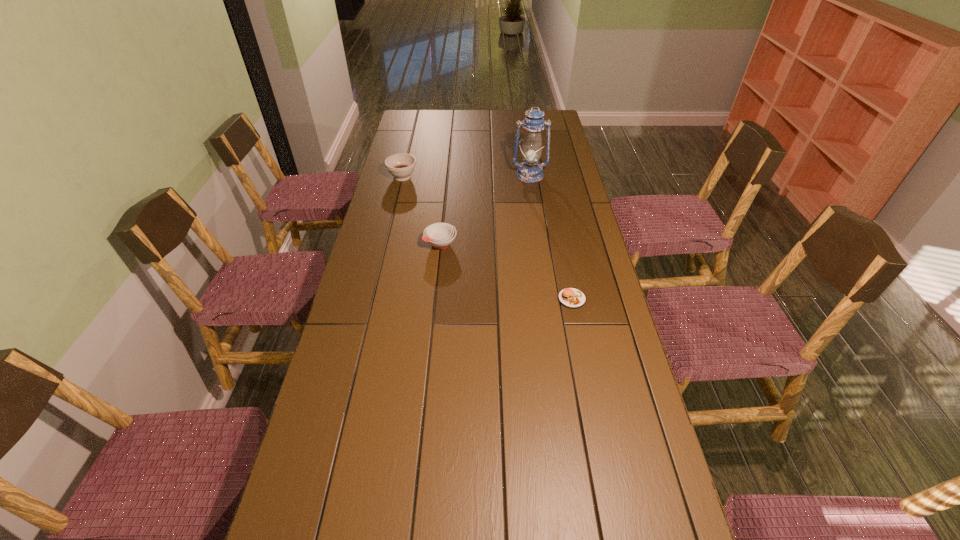
Image resolution: width=960 pixels, height=540 pixels. What are the coordinates of `free space located 0.070m on the back of the patty` in the screenshot? It's located at (566, 274).

This screenshot has height=540, width=960. What are the coordinates of `object positioned at the left edge` in the screenshot? It's located at (401, 166).

Where is `lantern present at the right edge`? lantern present at the right edge is located at coordinates (530, 171).

You are a GUI agent. You are given a task and a screenshot of the screen. Output one action in this format:
    pyautogui.click(x=<x>, y=<y>)
    Task: Click on the patty located at the right edge
    The height and width of the screenshot is (540, 960).
    Given the screenshot: What is the action you would take?
    pyautogui.click(x=573, y=298)

Where is `vacant area at the far edge of the desktop`? The height and width of the screenshot is (540, 960). vacant area at the far edge of the desktop is located at coordinates (518, 111).

In the image, there is a desktop. At what (x,y) coordinates should I click in order to perform the action: click on vacant space at the left edge. Please return your answer as a coordinate pair (x, y). Image resolution: width=960 pixels, height=540 pixels. Looking at the image, I should click on (322, 434).

You are a GUI agent. You are given a task and a screenshot of the screen. Output one action in this format:
    pyautogui.click(x=<x>, y=<y>)
    Task: Click on the vacant space at the right edge of the desktop
    Image resolution: width=960 pixels, height=540 pixels.
    Given the screenshot: What is the action you would take?
    pyautogui.click(x=587, y=302)

This screenshot has height=540, width=960. Find the location of `vacant region at the far left corner`. vacant region at the far left corner is located at coordinates (404, 119).

Find the location of a particular element. Image resolution: width=960 pixels, height=540 pixels. free spot between the patty and the right soup bowl is located at coordinates (506, 271).

Where is `unoccupied position between the lantern and the nearest object`? This screenshot has width=960, height=540. unoccupied position between the lantern and the nearest object is located at coordinates coord(551,237).